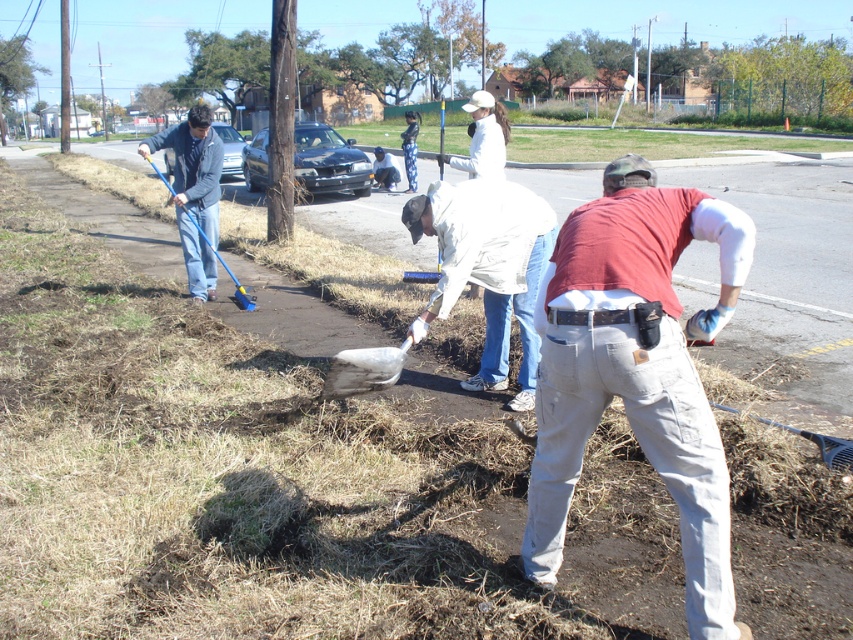
Question: Which object appears closest to the camera in this image?

Choices:
 (A) white matte jacket at center
 (B) white plastic shovel at center
 (C) denim jeans at lower right

Answer: (C)

Question: Does white plastic shovel at center lie in front of blue plastic shovel at left?

Choices:
 (A) no
 (B) yes

Answer: (B)

Question: Does white matte jacket at center lie in front of white plastic shovel at center?

Choices:
 (A) yes
 (B) no

Answer: (B)

Question: Estimate the real-world distances between objects in this image. Which object is closer to the denim jeans at lower right?

Choices:
 (A) white matte jacket at center
 (B) white plastic shovel at center
 (C) blue plastic shovel at left

Answer: (B)

Question: Can you confirm if denim jeans at lower right is positioned to the left of blue plastic shovel at left?

Choices:
 (A) no
 (B) yes

Answer: (A)

Question: Which point is farther to the camera?

Choices:
 (A) denim jeans at lower right
 (B) white matte jacket at center

Answer: (B)